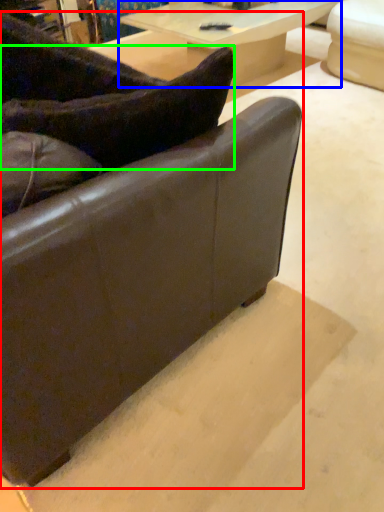
Question: Which object is positioned closest to studio couch (highlighted by a red box)? Select from table (highlighted by a blue box) and pillow (highlighted by a green box).

Choices:
 (A) table
 (B) pillow

Answer: (B)